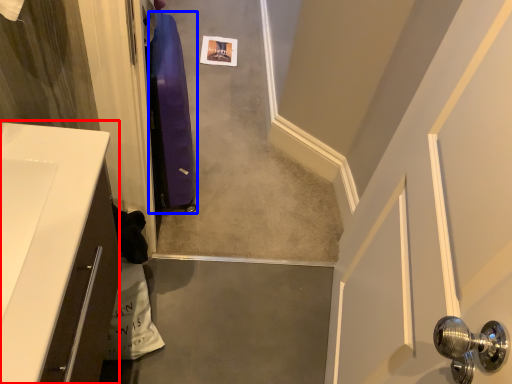
Question: Which of the following is the farthest to the observer, counter top (highlighted by a red box) or luggage (highlighted by a blue box)?

Choices:
 (A) counter top
 (B) luggage

Answer: (B)